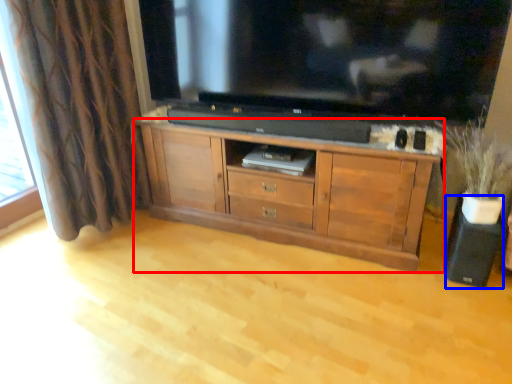
Question: Among these objects, which one is nearest to the camera, cabinetry (highlighted by a red box) or speaker (highlighted by a blue box)?

Choices:
 (A) cabinetry
 (B) speaker

Answer: (A)